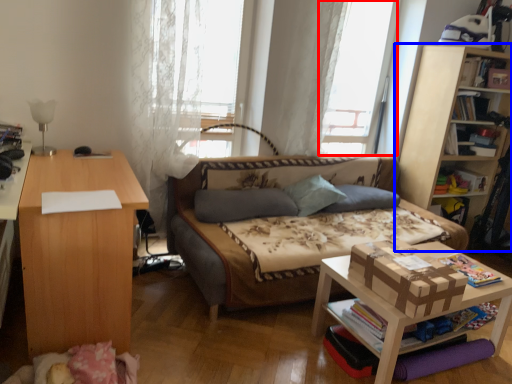
Question: Which of the following is the closest to the observer, window screen (highlighted by a red box) or bookcase (highlighted by a blue box)?

Choices:
 (A) window screen
 (B) bookcase

Answer: (A)